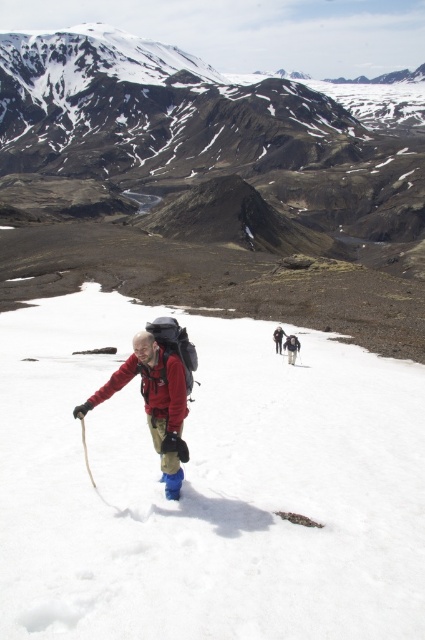
Between point (81, 170) and point (289, 362), which one is positioned in front?

Point (289, 362) is in front.

This screenshot has width=425, height=640. Describe the element at coordinates (218, 132) in the screenshot. I see `dark brown rocky mountain at upper center` at that location.

The width and height of the screenshot is (425, 640). Find the location of `dark brown rocky mountain at upper center`. dark brown rocky mountain at upper center is located at coordinates (218, 132).

Between white fluffy snow at center and dark gray backpack at center, which one appears on the right side from the viewer's perspective?

From the viewer's perspective, dark gray backpack at center appears more on the right side.

Does white fluffy snow at center come in front of dark gray backpack at center?

Yes, it is in front of dark gray backpack at center.

At what (x,y) coordinates should I click in order to perform the action: click on white fluffy snow at center. Please return your answer as a coordinate pair (x, y). Looking at the image, I should click on (207, 486).

Between white fluffy snow at center and matte red jacket at center, which one appears on the left side from the viewer's perspective?

matte red jacket at center

Can you confirm if white fluffy snow at center is positioned below matte red jacket at center?

Indeed, white fluffy snow at center is positioned under matte red jacket at center.

The height and width of the screenshot is (640, 425). What do you see at coordinates (207, 486) in the screenshot?
I see `white fluffy snow at center` at bounding box center [207, 486].

What are the coordinates of `white fluffy snow at center` in the screenshot? It's located at (207, 486).